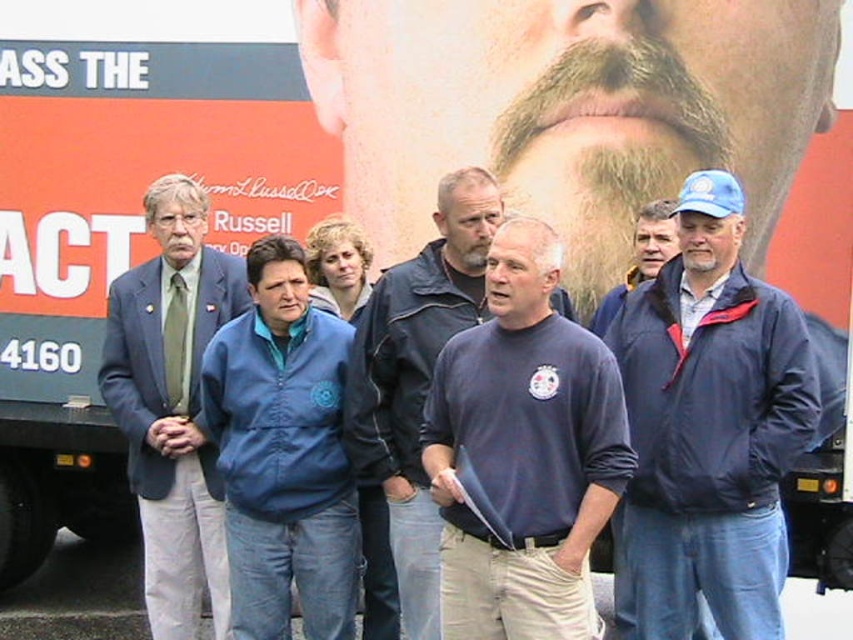
You are organizing a clothing donation drive and need to determine which of the two blue jackets at the center of the image is wider. The blue nylon jacket at center and the blue jacket at center are both present. Which one has a greater width?

The blue nylon jacket at center has a greater width than the blue jacket at center according to the description.

You are a photographer at the event and need to capture a photo of the dark blue sweatshirt at center. Where should you aim your camera?

You should aim your camera at point (524,451) to capture the dark blue sweatshirt at center.